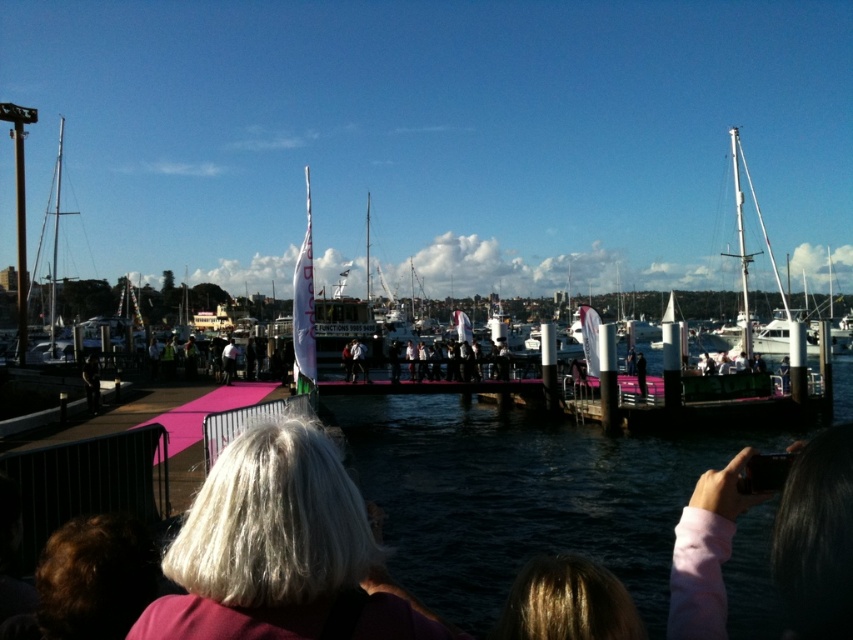
You are a photographer positioned at the dock and want to capture both the pink fabric at lower right and the white glossy sailboat at right in a single shot. Which object should you adjust your camera angle to focus on first to ensure both are visible?

The pink fabric at lower right is in front of the white glossy sailboat at right, so you should focus on the pink fabric at lower right first to ensure both are visible in the frame.

You are standing at the waterfront scene and want to walk from point A to point B. Point A is at coordinates point (741, 260) and point B is at coordinates point (97, 384). Since you are facing the scene, which direction should you turn to move from point A to point B?

Point (741, 260) is further to the viewer than point (97, 384). To move from point A to point B, you should turn towards the right and downward direction since point B is located to the right and further away from you compared to point A.